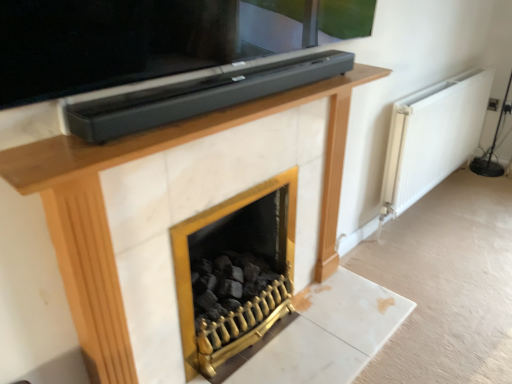
This screenshot has height=384, width=512. I want to click on gold metallic fireplace at center, so click(x=234, y=272).

Describe the element at coordinates (234, 272) in the screenshot. I see `gold metallic fireplace at center` at that location.

Identify the location of white matte radiator at right. The height and width of the screenshot is (384, 512). (432, 137).

This screenshot has width=512, height=384. What do you see at coordinates (432, 137) in the screenshot?
I see `white matte radiator at right` at bounding box center [432, 137].

At what (x,y) coordinates should I click in order to perform the action: click on gold metallic fireplace at center. Please return your answer as a coordinate pair (x, y). Looking at the image, I should click on (234, 272).

Based on their positions, is white matte radiator at right located to the left or right of gold metallic fireplace at center?

From the image, it's evident that white matte radiator at right is to the right of gold metallic fireplace at center.

Which object is further away from the camera taking this photo, white matte radiator at right or gold metallic fireplace at center?

white matte radiator at right is further from the camera.

Considering the positions of point (426, 131) and point (266, 207), is point (426, 131) closer or farther from the camera than point (266, 207)?

Point (426, 131).

From the image's perspective, is white matte radiator at right on gold metallic fireplace at center?

Yes, from the image's perspective, white matte radiator at right is over gold metallic fireplace at center.

From a real-world perspective, is white matte radiator at right above or below gold metallic fireplace at center?

From a real-world perspective, white matte radiator at right is physically above gold metallic fireplace at center.

Does white matte radiator at right have a greater width compared to gold metallic fireplace at center?

No, white matte radiator at right is not wider than gold metallic fireplace at center.

Is white matte radiator at right taller than gold metallic fireplace at center?

Yes.

Based on their sizes in the image, would you say white matte radiator at right is bigger or smaller than gold metallic fireplace at center?

In the image, white matte radiator at right appears to be larger than gold metallic fireplace at center.

In the scene shown: Is white matte radiator at right outside of gold metallic fireplace at center?

white matte radiator at right lies outside gold metallic fireplace at center's area.

Is the surface of white matte radiator at right in direct contact with gold metallic fireplace at center?

They are not placed beside each other.

Could you tell me if white matte radiator at right is turned towards gold metallic fireplace at center?

No, white matte radiator at right is not oriented towards gold metallic fireplace at center.

What's the angular difference between white matte radiator at right and gold metallic fireplace at center's facing directions?

They differ by 0.299 degrees in their facing directions.

At what (x,y) coordinates should I click in order to perform the action: click on fireplace on the left of the white matte radiator at right. Please return your answer as a coordinate pair (x, y). Image resolution: width=512 pixels, height=384 pixels. Looking at the image, I should click on (234, 272).

Is gold metallic fireplace at center at the right side of white matte radiator at right?

In fact, gold metallic fireplace at center is to the left of white matte radiator at right.

Is gold metallic fireplace at center in front of or behind white matte radiator at right in the image?

gold metallic fireplace at center is positioned closer to the viewer than white matte radiator at right.

Which is less distant, (x=204, y=295) or (x=428, y=177)?

Clearly, point (x=204, y=295) is closer to the camera than point (x=428, y=177).

From the image's perspective, which one is positioned lower, gold metallic fireplace at center or white matte radiator at right?

gold metallic fireplace at center.

From a real-world perspective, is gold metallic fireplace at center beneath white matte radiator at right?

Yes.

Looking at their sizes, would you say gold metallic fireplace at center is wider or thinner than white matte radiator at right?

Considering their sizes, gold metallic fireplace at center looks broader than white matte radiator at right.

Which of these two, gold metallic fireplace at center or white matte radiator at right, stands shorter?

gold metallic fireplace at center is shorter.

Based on their sizes in the image, would you say gold metallic fireplace at center is bigger or smaller than white matte radiator at right?

gold metallic fireplace at center is smaller than white matte radiator at right.

Is gold metallic fireplace at center surrounding white matte radiator at right?

No, white matte radiator at right is not a part of gold metallic fireplace at center.

Is gold metallic fireplace at center with white matte radiator at right?

gold metallic fireplace at center and white matte radiator at right are clearly separated.

Is gold metallic fireplace at center turned away from white matte radiator at right?

No, gold metallic fireplace at center is not facing the opposite direction of white matte radiator at right.

What's the angular difference between gold metallic fireplace at center and white matte radiator at right's facing directions?

The angular difference between gold metallic fireplace at center and white matte radiator at right is 0.299 degrees.

Identify the location of fireplace located below the white matte radiator at right (from the image's perspective). (234, 272).

The width and height of the screenshot is (512, 384). What are the coordinates of `fireplace that is under the white matte radiator at right (from a real-world perspective)` in the screenshot? It's located at (234, 272).

The image size is (512, 384). I want to click on radiator on the right of gold metallic fireplace at center, so click(432, 137).